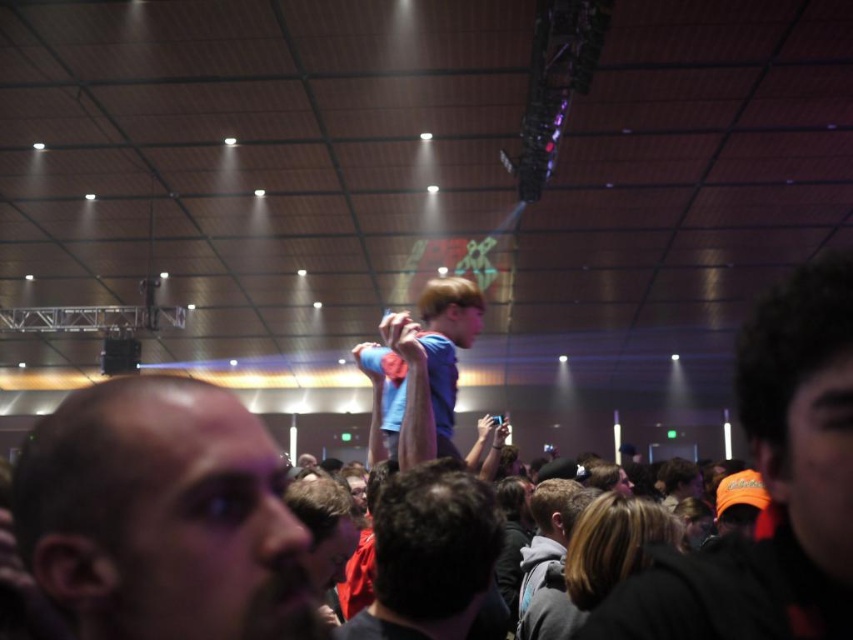
You are standing at the center of the venue and notice an orange knit cap at point (770, 486). If you walk straight towards the stage, will you pass by the orange knit cap at center before reaching the stage?

The orange knit cap at center is located at point (770, 486). Since the stage is in the background, walking straight towards it would mean moving away from the orange knit cap at center, so you would not pass by it before reaching the stage.

In the scene shown: You are standing at the back of the venue and see the orange knit cap at center and the dark blue shirt at center. Which one is higher from your viewpoint?

The orange knit cap at center is above the dark blue shirt at center, so it is higher from your viewpoint.

From the picture: You are standing at the entrance of the venue and want to move towards the stage. There are two points marked in the image, point A at coordinates point (164,484) and point B at coordinates point (436,413). Which point should you walk towards to get closer to the stage?

Point A at coordinates point (164,484) is closer to the viewer than point B at coordinates point (436,413). Therefore, walking towards point A will get you closer to the stage.